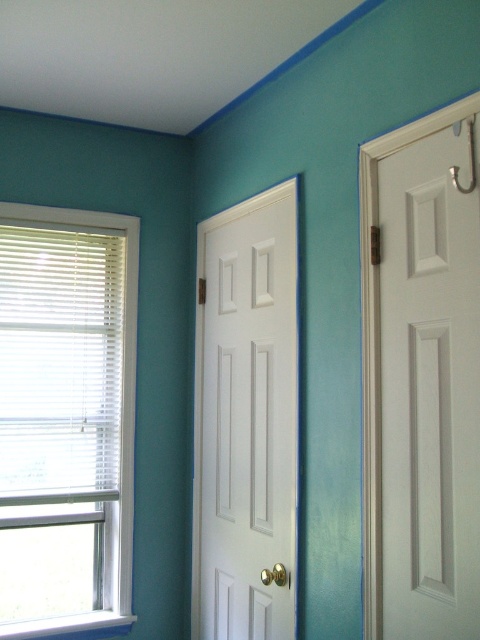
Is white matte door at right bigger than white glossy door at center?

Actually, white matte door at right might be smaller than white glossy door at center.

This screenshot has height=640, width=480. What do you see at coordinates (430, 384) in the screenshot? I see `white matte door at right` at bounding box center [430, 384].

Which is in front, point (443, 225) or point (260, 436)?

Point (443, 225) is in front.

Find the location of a particular element. Image resolution: width=480 pixels, height=640 pixels. white matte door at right is located at coordinates (430, 384).

Who is shorter, white plastic window at left or white matte door at right?

Standing shorter between the two is white matte door at right.

Does white plastic window at left have a larger size compared to white matte door at right?

Indeed, white plastic window at left has a larger size compared to white matte door at right.

You are a GUI agent. You are given a task and a screenshot of the screen. Output one action in this format:
    pyautogui.click(x=<x>, y=<y>)
    Task: Click on the white plastic window at left
    
    Given the screenshot: What is the action you would take?
    pyautogui.click(x=66, y=419)

Is white plastic window at left positioned behind white glossy door at center?

Yes, it is behind white glossy door at center.

Find the location of a particular element. The image size is (480, 640). white plastic window at left is located at coordinates (66, 419).

Image resolution: width=480 pixels, height=640 pixels. What are the coordinates of `white plastic window at left` in the screenshot? It's located at (66, 419).